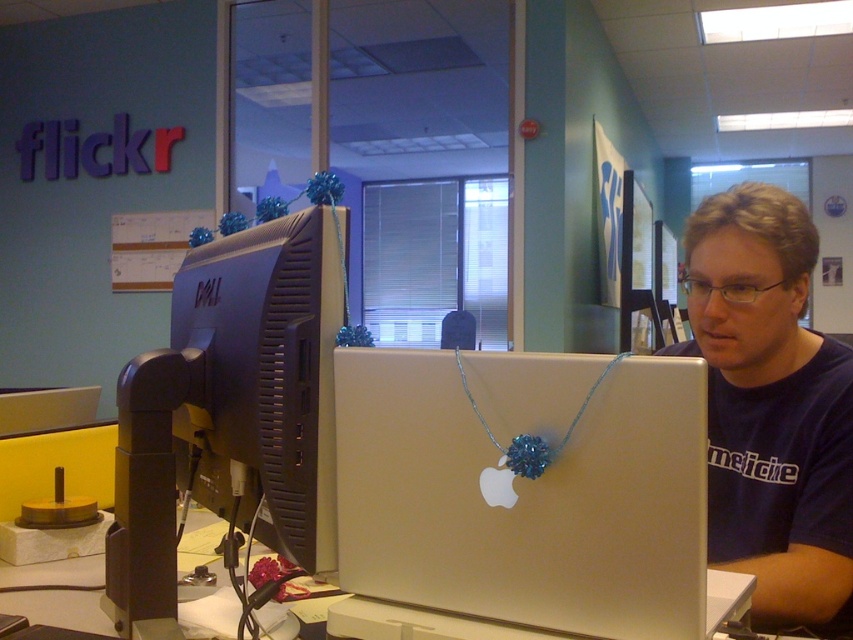
Question: Does silver metallic laptop at center have a smaller size compared to blue fabric shirt at center?

Choices:
 (A) yes
 (B) no

Answer: (A)

Question: Is matte black monitor at left to the right of blue fabric shirt at center from the viewer's perspective?

Choices:
 (A) no
 (B) yes

Answer: (A)

Question: Which of the following is the farthest from the observer?

Choices:
 (A) matte black monitor at left
 (B) silver metallic laptop at center

Answer: (A)

Question: Which point is farther from the camera taking this photo?

Choices:
 (A) (109, 624)
 (B) (291, 460)
 (C) (730, 499)
 (D) (457, 428)

Answer: (C)

Question: Does silver metallic laptop at center appear on the right side of matte black monitor at left?

Choices:
 (A) no
 (B) yes

Answer: (B)

Question: Which object is farther from the camera taking this photo?

Choices:
 (A) silver metallic laptop at center
 (B) silver metallic computer desk at center

Answer: (B)